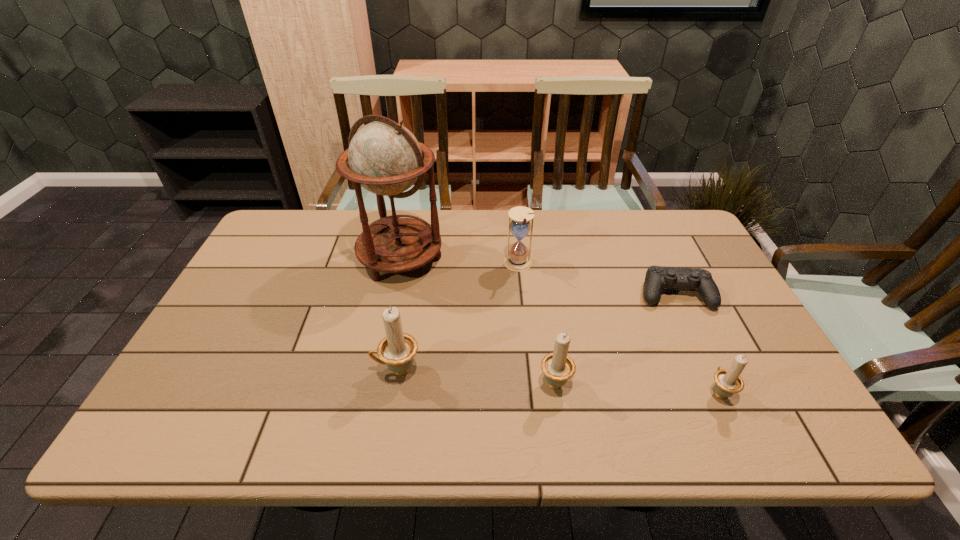
Locate an element on the screen. The image size is (960, 540). free space located on the handle side of the tallest candle_holder is located at coordinates coord(252,370).

Locate an element on the screen. Image resolution: width=960 pixels, height=540 pixels. blank space located on the handle side of the fourth tallest object is located at coordinates (537, 259).

In order to click on free space located 0.170m on the handle side of the fourth tallest object in this screenshot , I will do `click(544, 313)`.

Where is `free point located on the handle side of the fourth tallest object`? This screenshot has height=540, width=960. free point located on the handle side of the fourth tallest object is located at coordinates 547,333.

Image resolution: width=960 pixels, height=540 pixels. In order to click on vacant region located 0.100m on the handle side of the rightmost candle_holder in this screenshot , I will do `click(697, 345)`.

You are a GUI agent. You are given a task and a screenshot of the screen. Output one action in this format:
    pyautogui.click(x=<x>, y=<y>)
    Task: Click on the free spot located on the handle side of the rightmost candle_holder
    The height and width of the screenshot is (540, 960).
    Given the screenshot: What is the action you would take?
    pyautogui.click(x=679, y=305)

Locate an element on the screen. free location located 0.080m on the handle side of the rightmost candle_holder is located at coordinates point(700,351).

Image resolution: width=960 pixels, height=540 pixels. What are the coordinates of `vacant space located on the left of the hourglass` in the screenshot? It's located at (422, 264).

Where is `vacant space located on the surface of the tallest object`? vacant space located on the surface of the tallest object is located at coordinates [x=381, y=353].

At what (x,y) coordinates should I click in order to perform the action: click on vacant space located on the left of the shortest object. Please return your answer as a coordinate pair (x, y). This screenshot has height=540, width=960. Looking at the image, I should click on (518, 294).